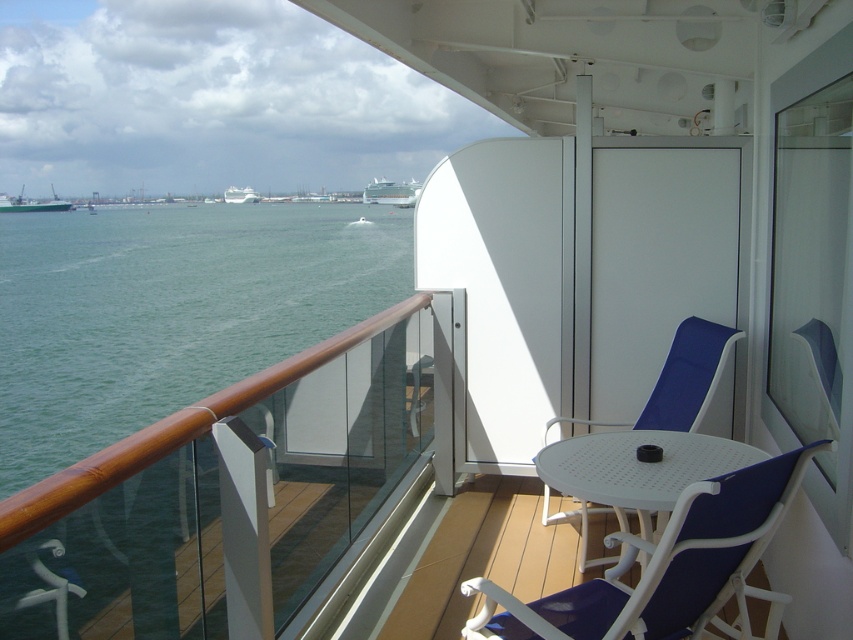
Is green water at lower left positioned behind white glossy cruise ship at upper center?

No, green water at lower left is in front of white glossy cruise ship at upper center.

How far apart are green water at lower left and white glossy cruise ship at upper center?

The distance of green water at lower left from white glossy cruise ship at upper center is 8.31 meters.

Is point (115, 429) positioned in front of point (407, 204)?

That is True.

Locate an element on the screen. green water at lower left is located at coordinates (167, 328).

Which is more to the left, green water at lower left or white metal table at center?

From the viewer's perspective, green water at lower left appears more on the left side.

Between point (57, 390) and point (604, 445), which one is positioned in front?

Point (604, 445) is more forward.

Locate an element on the screen. This screenshot has height=640, width=853. green water at lower left is located at coordinates (167, 328).

Find the location of `green water at lower left`. green water at lower left is located at coordinates (167, 328).

Which is behind, point (252, 289) or point (25, 209)?

The point (25, 209) is behind.

What are the coordinates of `green water at lower left` in the screenshot? It's located at (167, 328).